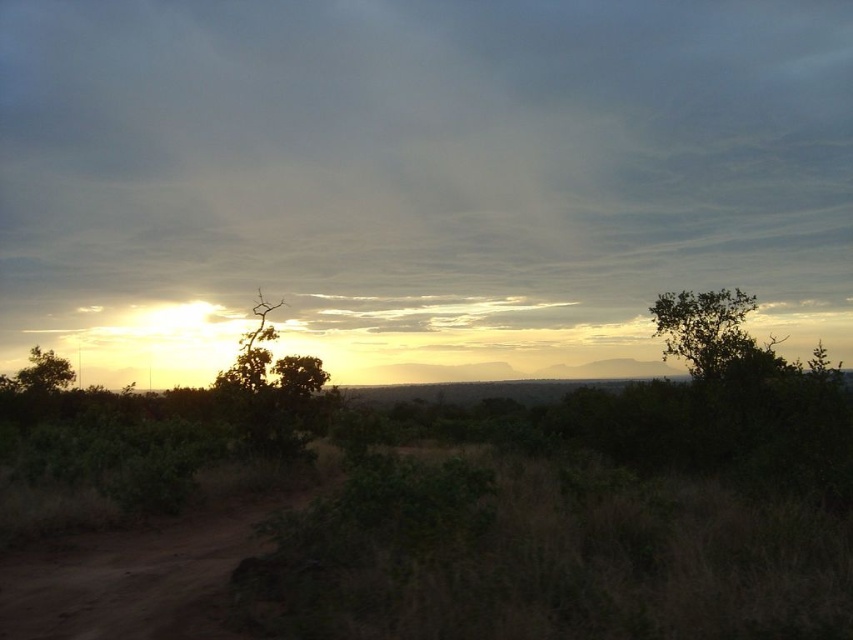
You are standing at the center of the image and want to walk towards the green leafy tree at right. Which direction should you turn to face the brown dirt track at lower left first before proceeding?

You should turn to your left to face the brown dirt track at lower left first, as it is located to the left of the green leafy tree at right. After facing the track, you can proceed towards the tree by adjusting your direction to the right.

You are standing at the center of the image. Which direction should you move to get closer to the green leafy tree at right?

Since the green leafy tree at right is located at coordinates approximately 0.514 on the x axis and 0.826 on the y axis, moving towards the right and slightly downward from the center would bring you closer to the green leafy tree at right.

You are a hiker planning to walk along the brown dirt track at lower left. You want to know if the translucent white cloud at upper center will block your view of the sun. Can you determine this based on the scene?

The translucent white cloud at upper center is positioned over the brown dirt track at lower left, so it may block your view of the sun depending on the sun position. However, since the cloud is translucent, some sunlight might still pass through, allowing partial visibility of the sun.